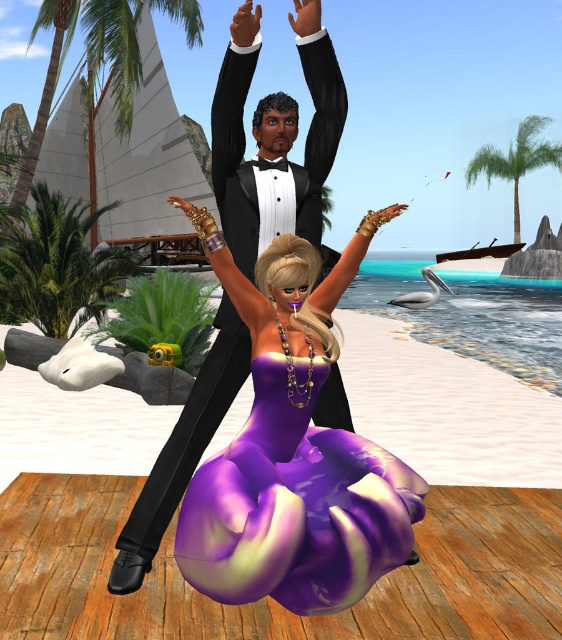
You are a painter standing on the beach in this scene. You want to paint both the green leafy palm tree at left and the green leafy palm tree at upper right. Which palm tree should you focus on first if you want to paint the thinner one first?

You should focus on the green leafy palm tree at left first because it is thinner than the green leafy palm tree at upper right.

You are standing at the tropical beach scene and want to walk towards the two points marked in the image. Which point, point [275,248] or point [88,250], will you reach first?

Point [275,248] is closer to the viewer than point [88,250], so you will reach point [275,248] first.